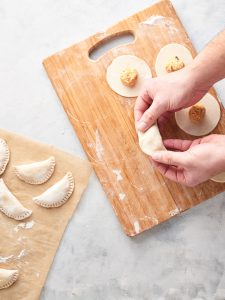
Identify the location of countertop. The width and height of the screenshot is (225, 300). (176, 271).